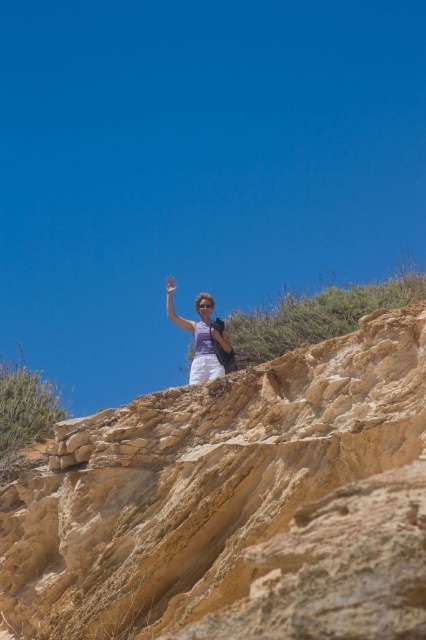
Is smooth sandstone cliff at upper center shorter than matte purple shirt at upper center?

In fact, smooth sandstone cliff at upper center may be taller than matte purple shirt at upper center.

Between smooth sandstone cliff at upper center and matte purple shirt at upper center, which one is positioned higher?

matte purple shirt at upper center

Is point (43, 624) positioned after point (209, 380)?

No.

Identify the location of smooth sandstone cliff at upper center. The width and height of the screenshot is (426, 640). (236, 504).